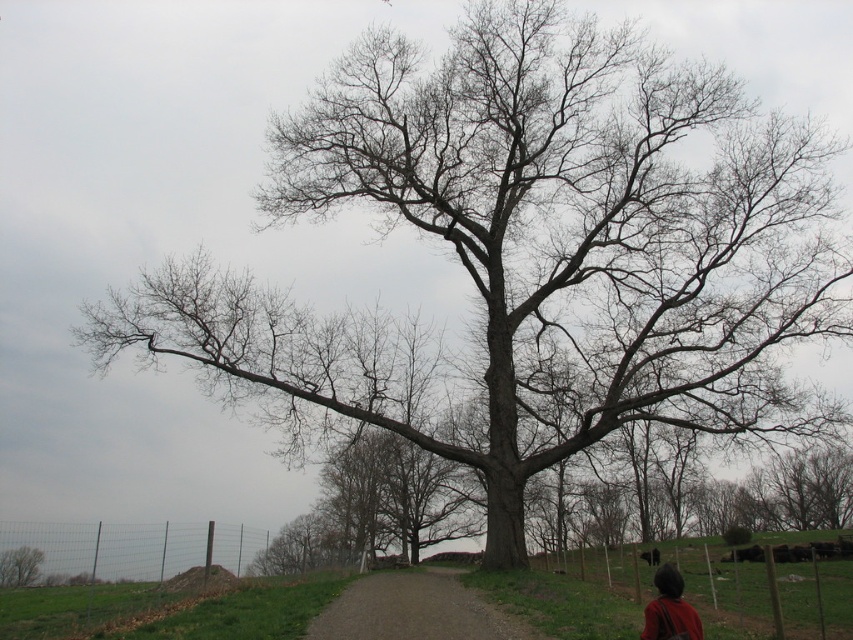
Question: Which object is positioned closest to the bare wood tree at lower left?

Choices:
 (A) brown leather backpack at lower right
 (B) dirt/gravel path at center

Answer: (B)

Question: Based on their relative distances, which object is nearer to the bare wood tree at lower left?

Choices:
 (A) dirt/gravel path at center
 (B) brown leather backpack at lower right

Answer: (A)

Question: Does dirt/gravel path at center appear on the right side of brown leather backpack at lower right?

Choices:
 (A) no
 (B) yes

Answer: (A)

Question: Does dirt/gravel path at center have a larger size compared to brown leather backpack at lower right?

Choices:
 (A) yes
 (B) no

Answer: (A)

Question: Can you confirm if brown leather backpack at lower right is wider than bare wood tree at lower left?

Choices:
 (A) no
 (B) yes

Answer: (A)

Question: Estimate the real-world distances between objects in this image. Which object is closer to the dirt/gravel path at center?

Choices:
 (A) brown leather backpack at lower right
 (B) bare wood tree at lower left

Answer: (A)